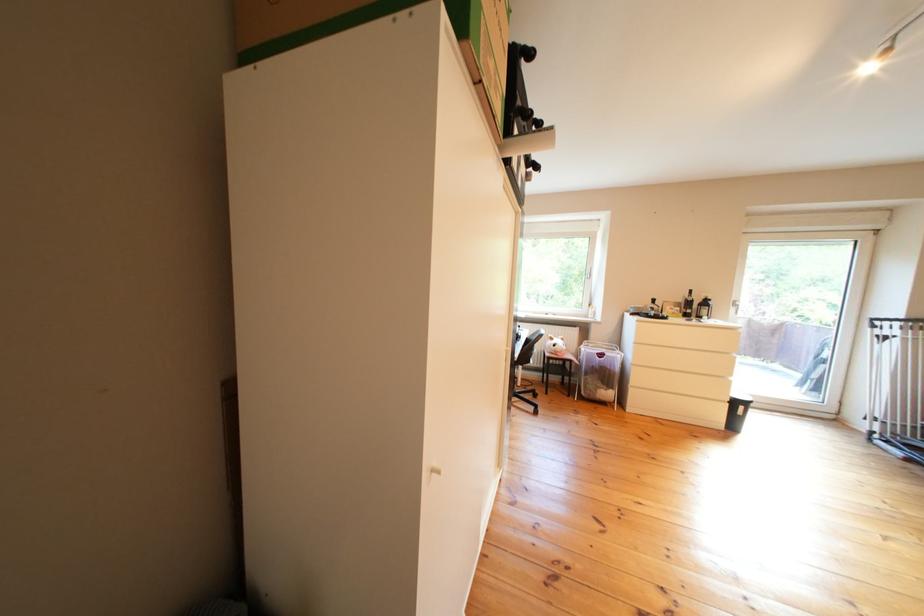
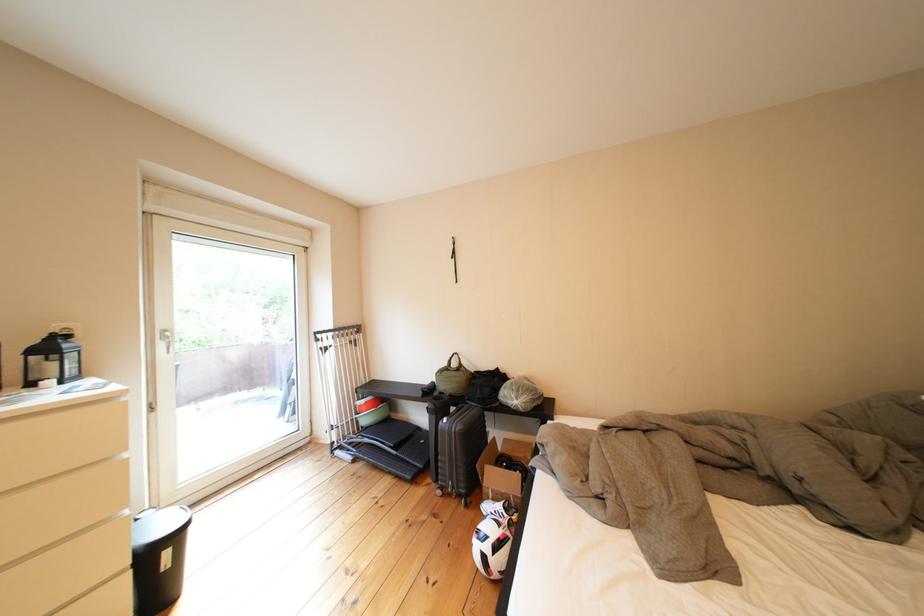
The point at (756, 411) is marked in the first image. Where is the corresponding point in the second image?

(179, 557)